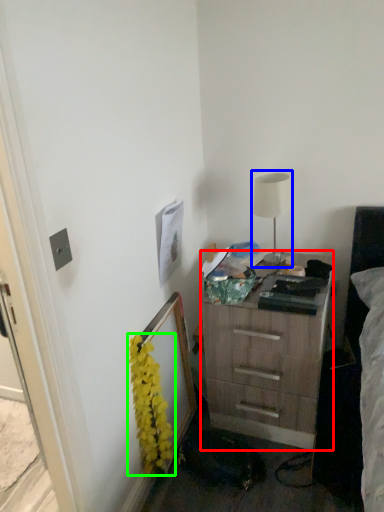
Question: Which object is the closest to the chest of drawers (highlighted by a red box)? Choose among these: table lamp (highlighted by a blue box) or flower (highlighted by a green box).

Choices:
 (A) table lamp
 (B) flower

Answer: (A)